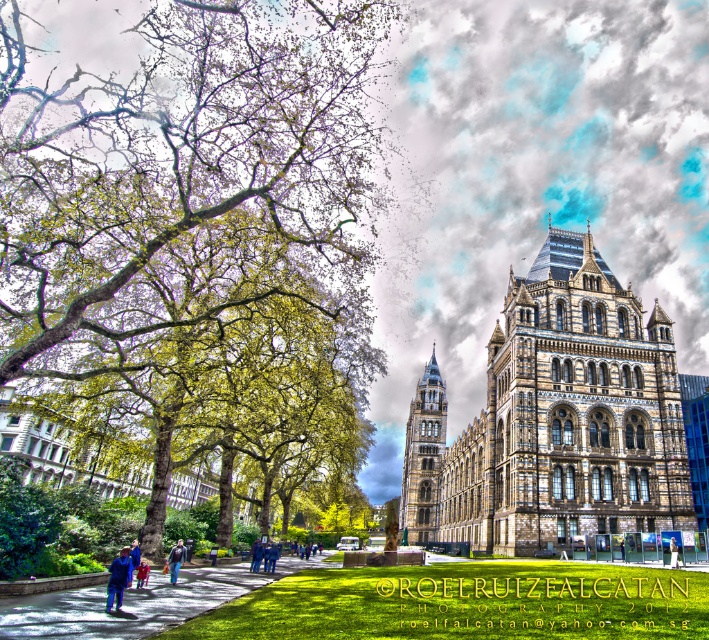
Measure the distance from blue denim jeans at center to blue fabric person at center.

blue denim jeans at center is 49.52 feet away from blue fabric person at center.

Between blue denim jeans at center and blue fabric person at center, which one is positioned lower?

blue denim jeans at center is below.

Is point (250, 554) closer to viewer compared to point (130, 579)?

That is False.

At what (x,y) coordinates should I click in order to perform the action: click on blue denim jeans at center. Please return your answer as a coordinate pair (x, y). Looking at the image, I should click on tap(255, 556).

Between green asphalt path at lower center and blue fabric jacket at lower left, which one has more height?

green asphalt path at lower center

Which is more to the right, green asphalt path at lower center or blue fabric jacket at lower left?

From the viewer's perspective, green asphalt path at lower center appears more on the right side.

Does point (162, 614) come closer to viewer compared to point (130, 572)?

Yes, it is in front of point (130, 572).

Identify the location of green asphalt path at lower center. The image size is (709, 640). (135, 602).

Which is below, brown stone church at center or blue denim jeans at lower left?

blue denim jeans at lower left

Is point (501, 456) closer to viewer compared to point (172, 579)?

No, (501, 456) is behind (172, 579).

Where is `brown stone church at center`? brown stone church at center is located at coordinates (554, 419).

This screenshot has height=640, width=709. I want to click on brown stone church at center, so click(554, 419).